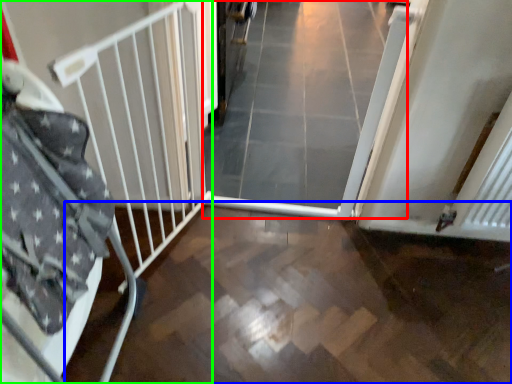
Question: Considering the real-world distances, which object is closest to plain (highlighted by a red box)? path (highlighted by a blue box) or bed frame (highlighted by a green box).

Choices:
 (A) path
 (B) bed frame

Answer: (A)